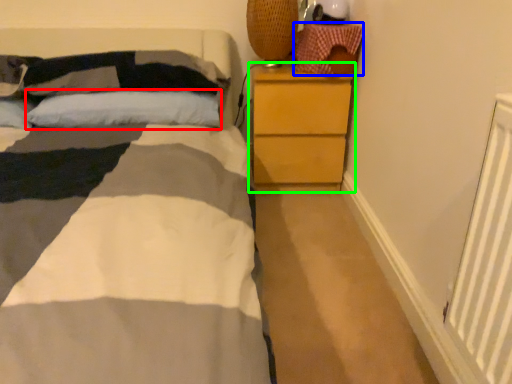
Question: Which object is positioned closest to pillow (highlighted by a red box)? Select from material (highlighted by a blue box) and chest of drawers (highlighted by a green box).

Choices:
 (A) material
 (B) chest of drawers

Answer: (B)